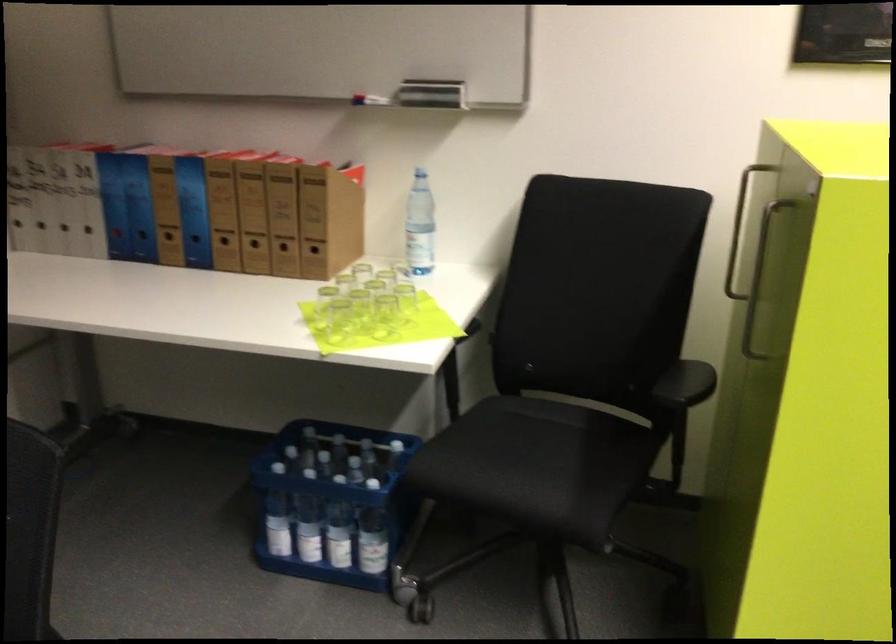
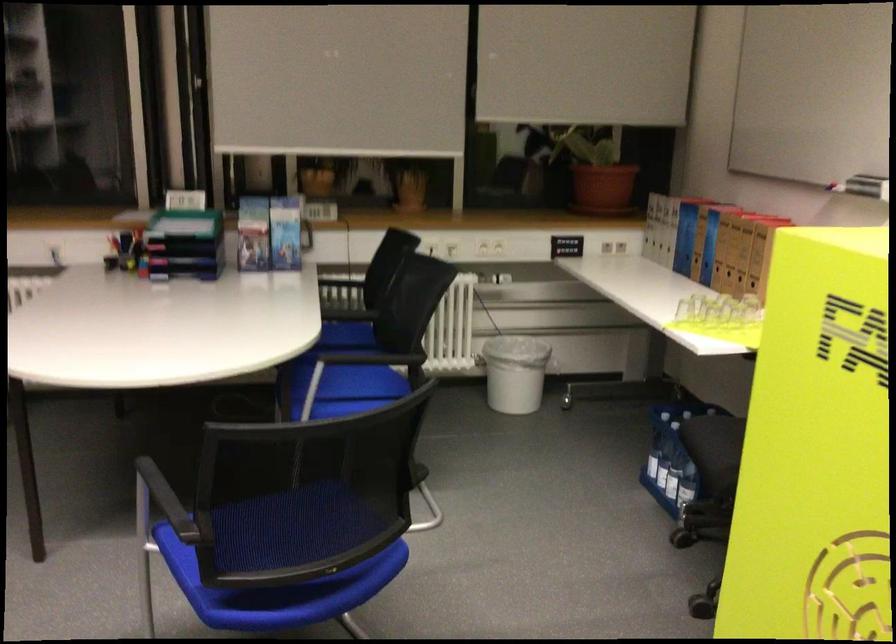
Locate, in the second image, the point that corresponds to pixel 135 214 in the first image.

(685, 238)